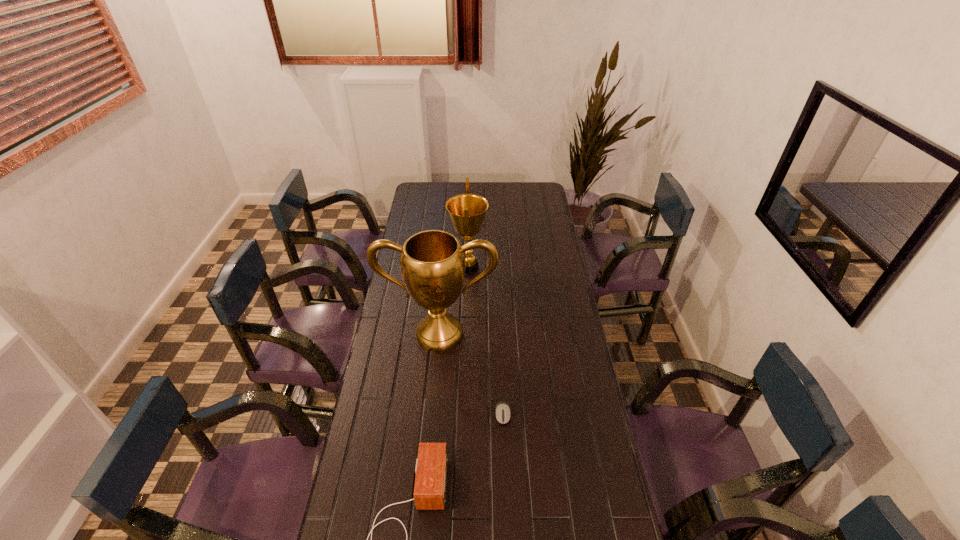
Find the location of a particular element. trophy cup is located at coordinates (432, 262).

At what (x,y) coordinates should I click in order to perform the action: click on award. Please return your answer as a coordinate pair (x, y). The height and width of the screenshot is (540, 960). Looking at the image, I should click on (467, 211).

Where is `computer equipment`? The image size is (960, 540). computer equipment is located at coordinates (502, 409).

Locate an element on the screen. The width and height of the screenshot is (960, 540). the shortest object is located at coordinates (502, 409).

Where is `vacant area situated 0.350m on the surface of the trophy cup with symbols`? The width and height of the screenshot is (960, 540). vacant area situated 0.350m on the surface of the trophy cup with symbols is located at coordinates 429,441.

Identify the location of vacant space situated 0.260m on the front view with handles of the award. The width and height of the screenshot is (960, 540). (542, 267).

I want to click on free location located 0.340m on the wheel side of the computer equipment, so click(x=508, y=538).

Where is `object at the left edge`? The image size is (960, 540). object at the left edge is located at coordinates (432, 262).

The width and height of the screenshot is (960, 540). In order to click on vacant space at the left edge of the desktop in this screenshot , I will do `click(388, 354)`.

At what (x,y) coordinates should I click in order to perform the action: click on free spot at the right edge of the desktop. Please return your answer as a coordinate pair (x, y). Looking at the image, I should click on (562, 439).